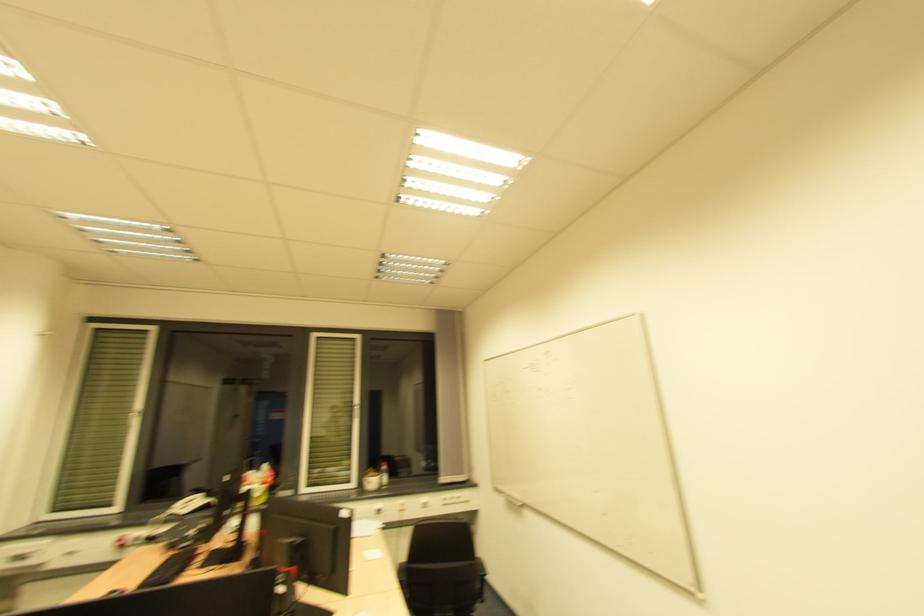
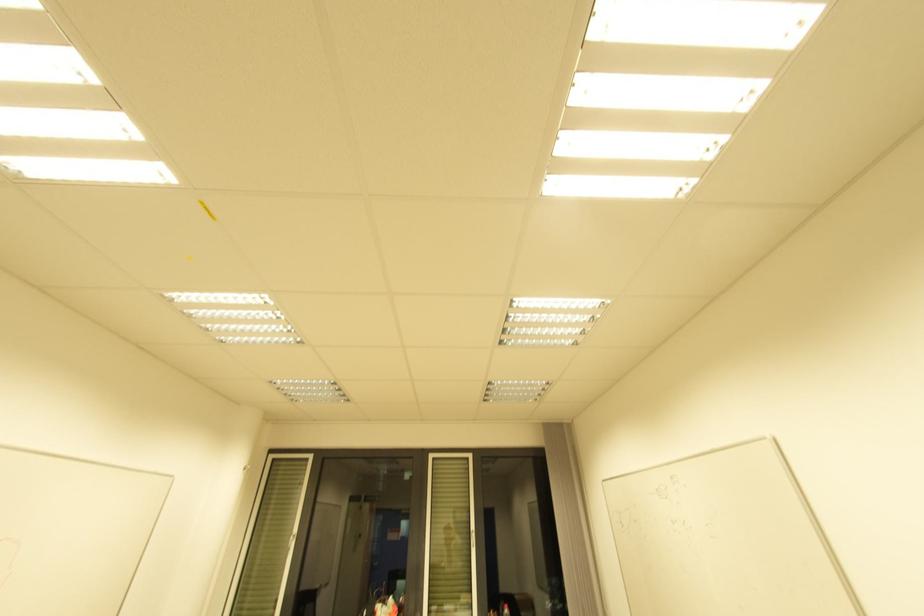
Question: Which direction would the cameraman need to move to produce the second image? Reply with the corresponding letter.

Choices:
 (A) Left
 (B) Right
 (C) Forward
 (D) Backward

Answer: (D)